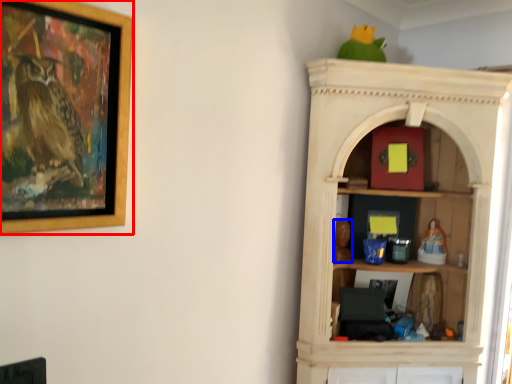
Question: Which point is closer to the camera, picture frame (highlighted by a red box) or toy (highlighted by a blue box)?

Choices:
 (A) picture frame
 (B) toy

Answer: (A)